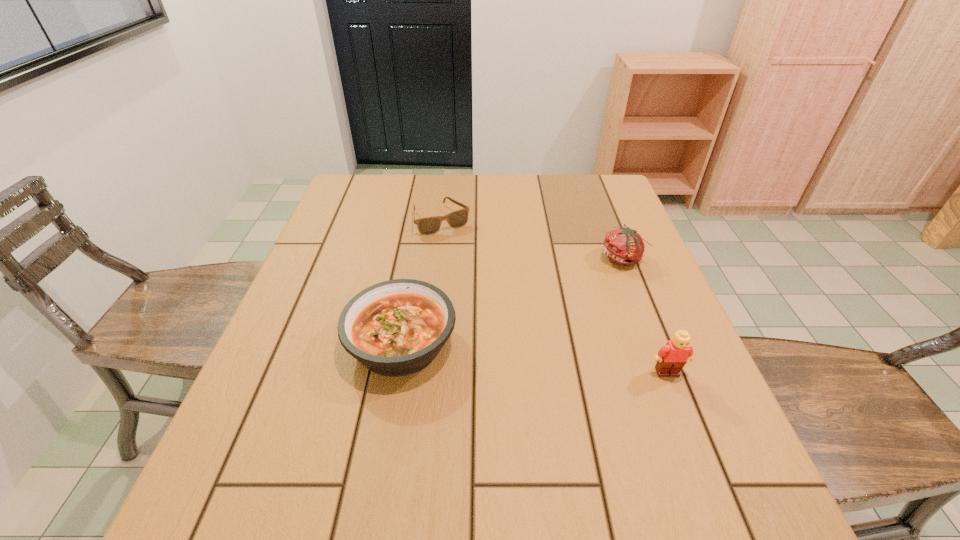
Locate an element on the screen. The height and width of the screenshot is (540, 960). free location at the far left corner of the desktop is located at coordinates (369, 205).

Image resolution: width=960 pixels, height=540 pixels. In the image, there is a desktop. Identify the location of free space at the far right corner. (603, 183).

In order to click on free location at the near right corner of the desktop in this screenshot , I will do `click(691, 424)`.

The width and height of the screenshot is (960, 540). Find the location of `vacant area between the stew and the tomato`. vacant area between the stew and the tomato is located at coordinates (512, 301).

I want to click on vacant space that is in between the stew and the tomato, so [x=512, y=301].

Where is `vacant point located between the third nearest object and the farthest object`? This screenshot has width=960, height=540. vacant point located between the third nearest object and the farthest object is located at coordinates (532, 239).

The width and height of the screenshot is (960, 540). I want to click on vacant area that lies between the stew and the third nearest object, so click(512, 301).

This screenshot has width=960, height=540. I want to click on free area in between the Lego and the shortest object, so [554, 296].

This screenshot has width=960, height=540. Find the location of `empty space between the Lego and the shortest object`. empty space between the Lego and the shortest object is located at coordinates (554, 296).

Where is `free space between the tallest object and the sunglasses`? free space between the tallest object and the sunglasses is located at coordinates (554, 296).